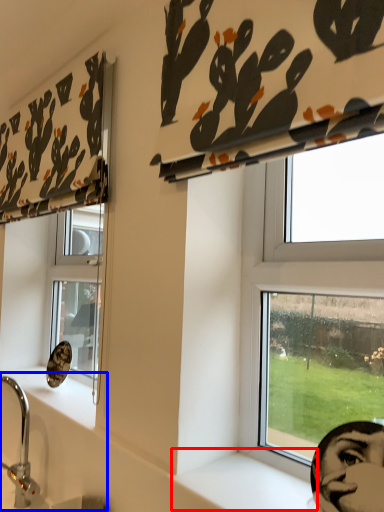
Question: Which of the following is the closest to the observer, window sill (highlighted by a red box) or sink (highlighted by a blue box)?

Choices:
 (A) window sill
 (B) sink

Answer: (A)